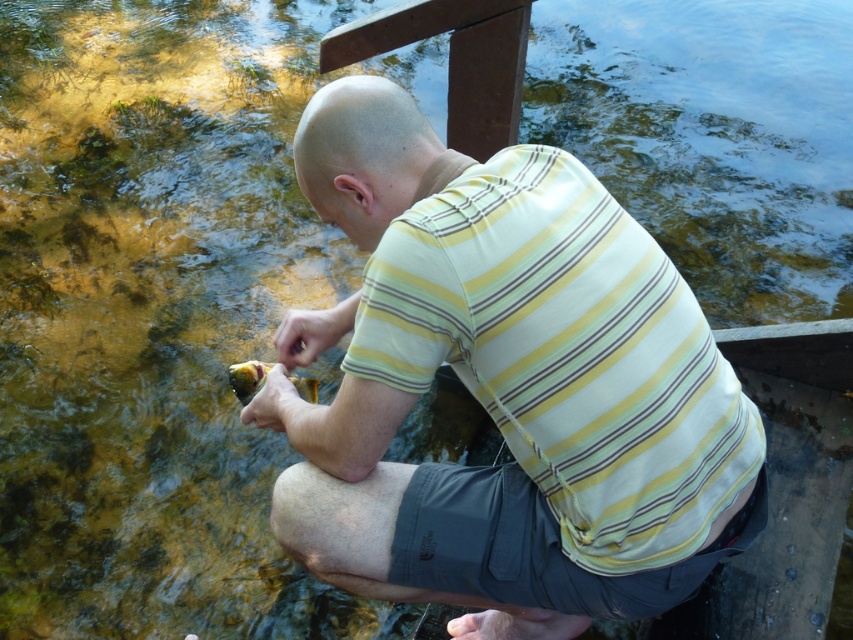
Question: Which point is closer to the camera taking this photo?

Choices:
 (A) (431, 492)
 (B) (256, 381)

Answer: (A)

Question: Does yellow striped shirt at center appear over shiny yellow fish at lower left?

Choices:
 (A) no
 (B) yes

Answer: (B)

Question: Which point is farther to the camera?

Choices:
 (A) yellow striped shirt at center
 (B) shiny yellow fish at lower left

Answer: (B)

Question: Considering the relative positions of yellow striped shirt at center and shiny yellow fish at lower left in the image provided, where is yellow striped shirt at center located with respect to shiny yellow fish at lower left?

Choices:
 (A) left
 (B) right

Answer: (B)

Question: Which point is closer to the camera?

Choices:
 (A) (527, 461)
 (B) (263, 372)

Answer: (A)

Question: Does yellow striped shirt at center lie behind shiny yellow fish at lower left?

Choices:
 (A) yes
 (B) no

Answer: (B)